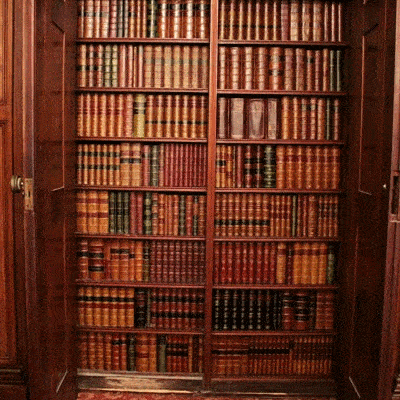
Where is `rug on the floor`? The image size is (400, 400). rug on the floor is located at coordinates (121, 394).